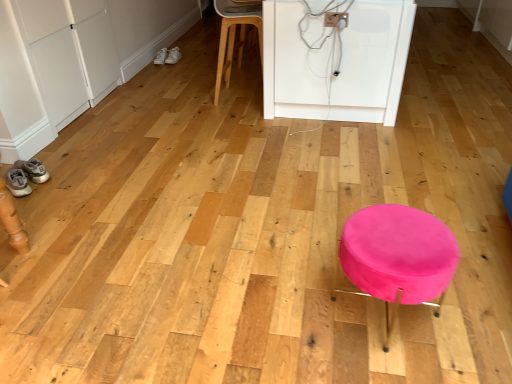
Question: From the image's perspective, is white leather sneakers at upper left, the second footwear in the back-to-front sequence, on top of light wood stool at center?

Choices:
 (A) yes
 (B) no

Answer: (A)

Question: Is white leather sneakers at upper left, the second footwear in the back-to-front sequence, to the left of light wood stool at center from the viewer's perspective?

Choices:
 (A) yes
 (B) no

Answer: (A)

Question: Does white leather sneakers at upper left, the 2th footwear positioned from the top, touch light wood stool at center?

Choices:
 (A) yes
 (B) no

Answer: (B)

Question: Can you confirm if white leather sneakers at upper left, arranged as the 2th footwear when viewed from the front, is thinner than light wood stool at center?

Choices:
 (A) no
 (B) yes

Answer: (B)

Question: Is white leather sneakers at upper left, the second footwear in the back-to-front sequence, far away from light wood stool at center?

Choices:
 (A) no
 (B) yes

Answer: (B)

Question: Is point (10, 190) positioned closer to the camera than point (162, 61)?

Choices:
 (A) closer
 (B) farther

Answer: (A)

Question: From the image's perspective, is matte gray sneakers at lower left, which appears as the third footwear when viewed from the back, positioned above or below white leather sneakers at upper left, the second footwear from the bottom?

Choices:
 (A) above
 (B) below

Answer: (B)

Question: Looking at their shapes, would you say matte gray sneakers at lower left, positioned as the first footwear in front-to-back order, is wider or thinner than white leather sneakers at upper left, the second footwear in the back-to-front sequence?

Choices:
 (A) thin
 (B) wide

Answer: (B)

Question: Looking at the image, does matte gray sneakers at lower left, positioned as the 1th footwear in bottom-to-top order, seem bigger or smaller compared to white leather sneakers at upper left, the second footwear viewed from the right?

Choices:
 (A) big
 (B) small

Answer: (B)

Question: Considering the positions of white leather sneakers at upper left, which ranks as the first footwear in right-to-left order, and white leather sneakers at upper left, the second footwear viewed from the right, in the image, is white leather sneakers at upper left, which ranks as the first footwear in right-to-left order, bigger or smaller than white leather sneakers at upper left, the second footwear viewed from the right,?

Choices:
 (A) small
 (B) big

Answer: (A)

Question: In terms of width, does white leather sneakers at upper left, which is the third footwear in left-to-right order, look wider or thinner when compared to white leather sneakers at upper left, the 2th footwear positioned from the top?

Choices:
 (A) thin
 (B) wide

Answer: (B)

Question: Is white leather sneakers at upper left, the third footwear ordered from the bottom, inside or outside of white leather sneakers at upper left, the second footwear viewed from the right?

Choices:
 (A) inside
 (B) outside

Answer: (B)

Question: Relative to white leather sneakers at upper left, arranged as the 2th footwear when viewed from the front, is white leather sneakers at upper left, which ranks as the first footwear in back-to-front order, in front or behind?

Choices:
 (A) front
 (B) behind

Answer: (B)

Question: Relative to pink velvet stool at center, is white leather sneakers at upper left, acting as the second footwear starting from the left, in front or behind?

Choices:
 (A) front
 (B) behind

Answer: (B)

Question: From a real-world perspective, is white leather sneakers at upper left, the second footwear from the bottom, positioned above or below pink velvet stool at center?

Choices:
 (A) above
 (B) below

Answer: (B)